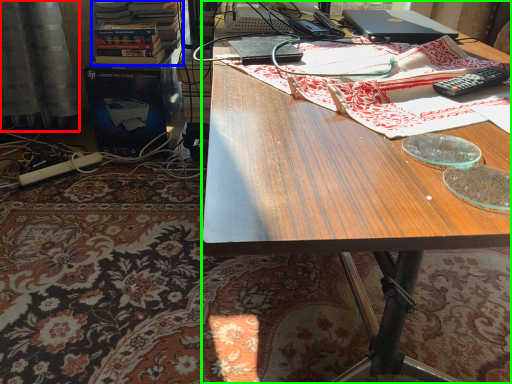
Question: Which object is positioned farthest from curtain (highlighted by a red box)? Select from book (highlighted by a blue box) and desk (highlighted by a green box).

Choices:
 (A) book
 (B) desk

Answer: (B)